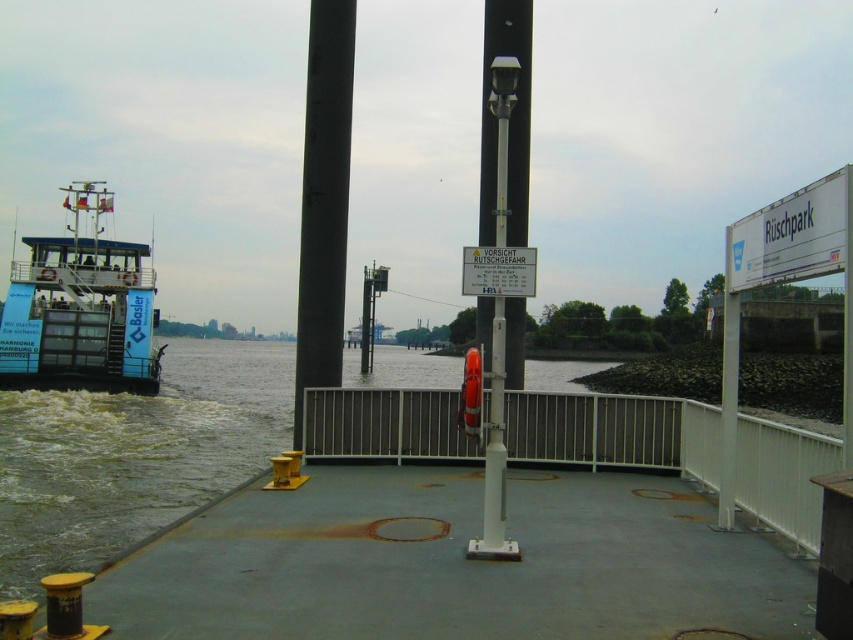
You are standing at the dock and need to board the ferry. The ferry is currently moving away from the dock. If the gap between the blue painted steel ferry at left and the white plastic sign at right is 22.81 meters, can you safely walk across the gap to reach the ferry before it gets further away?

The gap between the blue painted steel ferry at left and the white plastic sign at right is 22.81 meters. Walking across such a large gap is not safe, so you cannot reach the ferry before it moves further away.

You are standing at the dock and want to know how far the point at coordinates (521,16) is from your current position. Can you determine the distance?

The point at coordinates (521,16) is 43.98 feet away from your current position.

You are standing at the dock and notice a point marked at coordinates (80, 308). Which object does this point correspond to?

The point corresponds to the blue painted steel ferry at left.